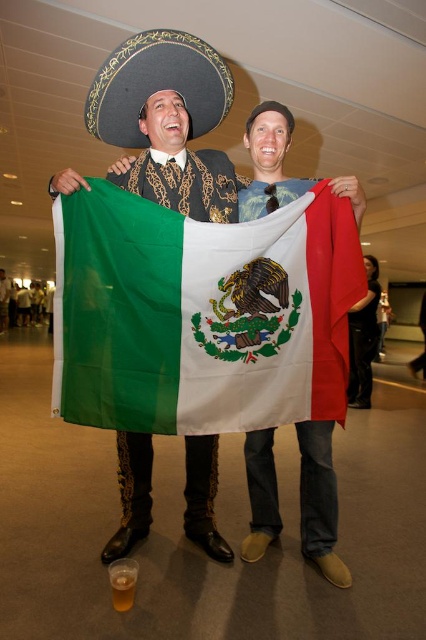
Question: Is polyester mexican flag at center in front of translucent plastic cup at lower left?

Choices:
 (A) yes
 (B) no

Answer: (A)

Question: Is polyester mexican flag at center to the left of translucent plastic cup at lower left from the viewer's perspective?

Choices:
 (A) no
 (B) yes

Answer: (A)

Question: Estimate the real-world distances between objects in this image. Which object is farther from the black felt sombrero at upper center?

Choices:
 (A) translucent plastic cup at lower left
 (B) matte white flag at center
 (C) black leather pants at lower right
 (D) polyester mexican flag at center

Answer: (C)

Question: Which of the following is the closest to the observer?

Choices:
 (A) (117, 592)
 (B) (319, 532)
 (C) (333, 554)

Answer: (A)

Question: Is matte green flag at center to the right of matte white flag at center from the viewer's perspective?

Choices:
 (A) yes
 (B) no

Answer: (B)

Question: Which of the following is the farthest from the observer?

Choices:
 (A) translucent plastic cup at lower left
 (B) matte white flag at center
 (C) black leather pants at lower right
 (D) matte green flag at center

Answer: (C)